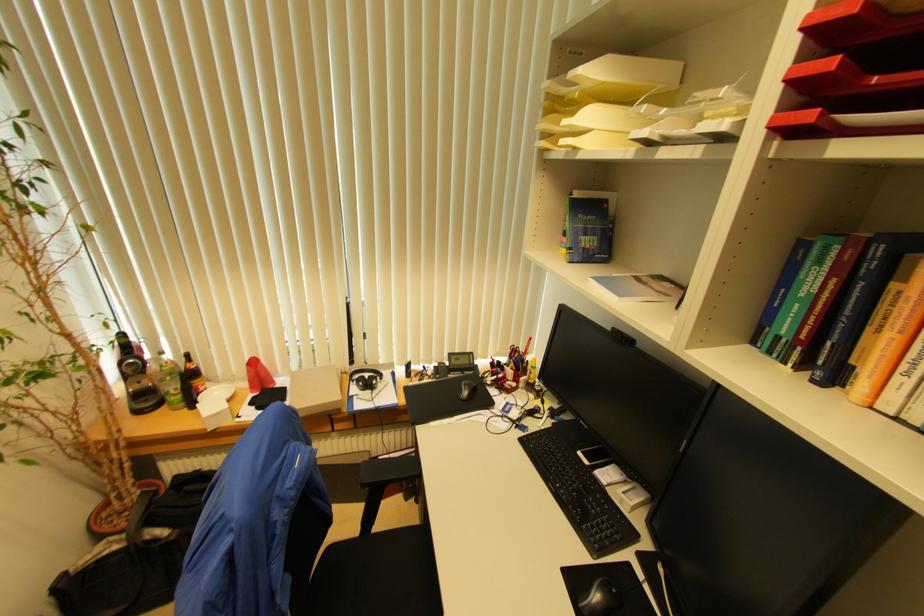
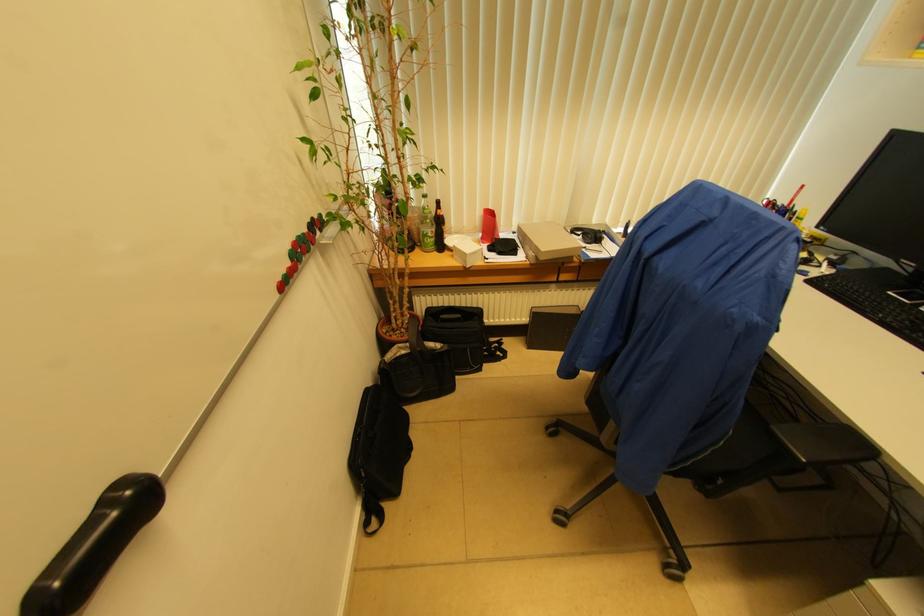
The point at (x=371, y=384) is marked in the first image. Where is the corresponding point in the second image?

(599, 237)